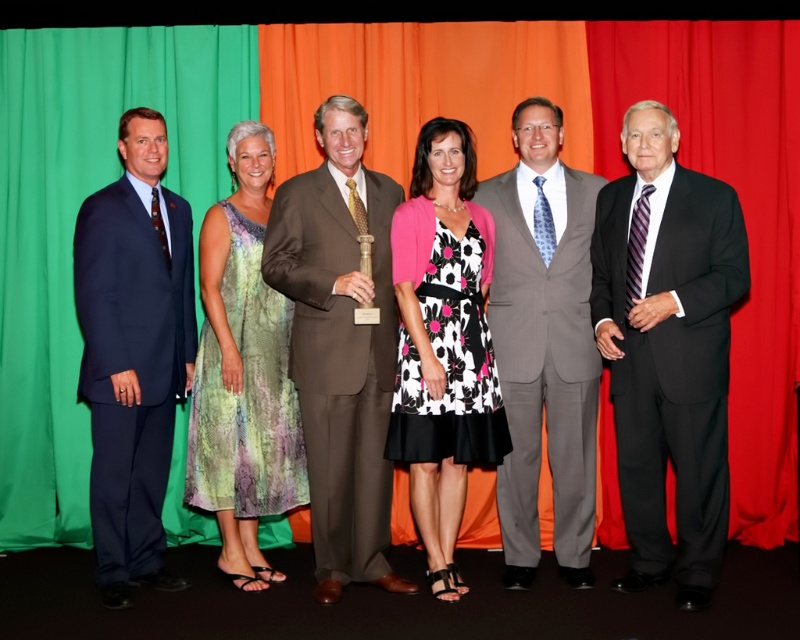
Question: Which object is farther from the camera taking this photo?

Choices:
 (A) multicolored sheer dress at center
 (B) matte blue suit at left
 (C) floral-patterned dress at center
 (D) gray pinstripe suit at center

Answer: (D)

Question: Among these points, which one is farthest from the camera?

Choices:
 (A) (110, 596)
 (B) (748, 269)

Answer: (A)

Question: Can you confirm if brown suit at center is thinner than gray pinstripe suit at center?

Choices:
 (A) no
 (B) yes

Answer: (A)

Question: Can you confirm if matte blue suit at left is positioned to the left of floral-patterned dress at center?

Choices:
 (A) yes
 (B) no

Answer: (A)

Question: Which point is farther to the camera?

Choices:
 (A) gray pinstripe suit at center
 (B) brown suit at center
 (C) matte blue suit at left

Answer: (A)

Question: Is black suit at right above gray pinstripe suit at center?

Choices:
 (A) no
 (B) yes

Answer: (A)